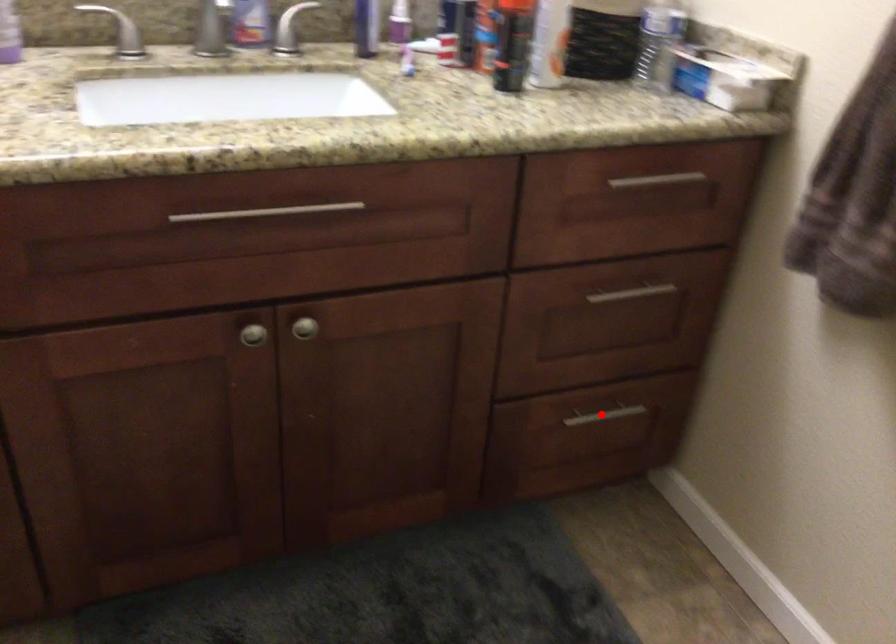
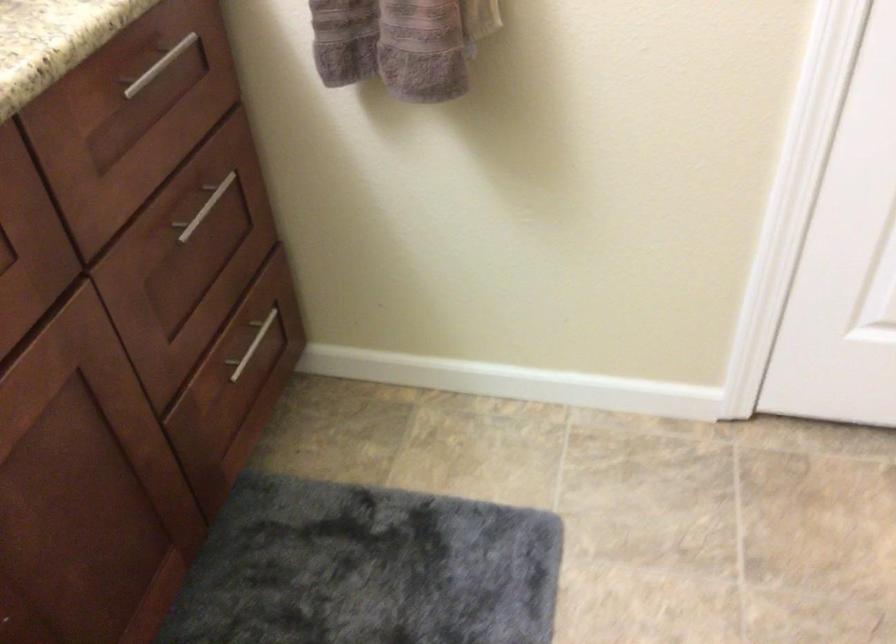
Question: I am providing you with two images of the same scene from different viewpoints. Image1 has a red point marked. In image2, the corresponding 3D location appears at what relative position? Reply with the corresponding letter.

Choices:
 (A) Closer
 (B) Farther

Answer: (A)